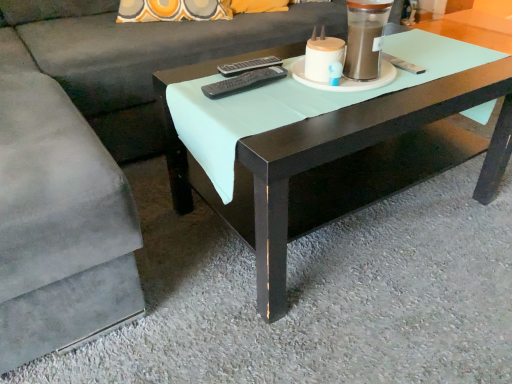
Where is `free point above matte black coffee table at center (from a real-world perspective)`? The height and width of the screenshot is (384, 512). free point above matte black coffee table at center (from a real-world perspective) is located at coordinates (323, 84).